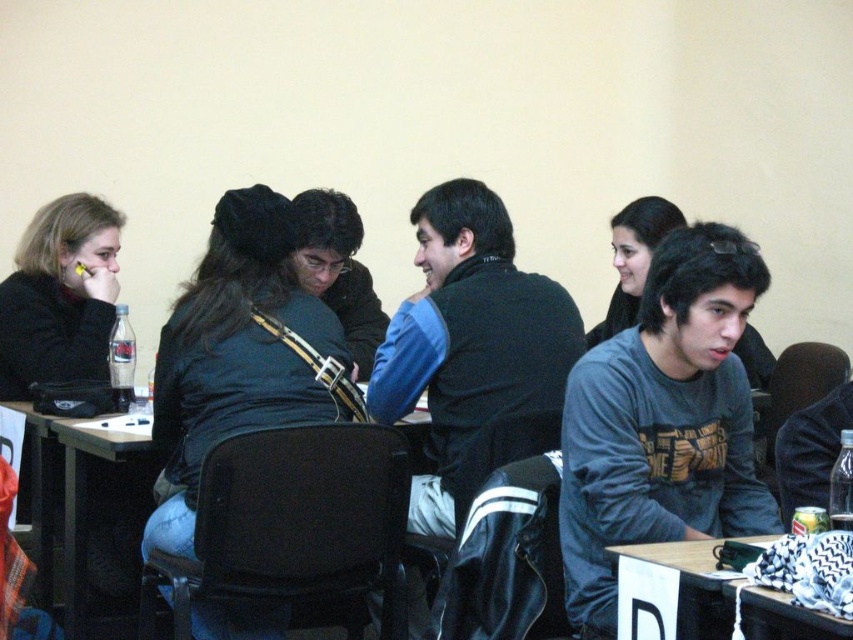
Who is lower down, dark green sweater at center or black plastic table at center?

black plastic table at center is lower down.

Is dark green sweater at center below black plastic table at center?

No, dark green sweater at center is not below black plastic table at center.

The image size is (853, 640). In order to click on dark green sweater at center in this screenshot , I will do `click(242, 342)`.

Where is `dark green sweater at center`? dark green sweater at center is located at coordinates (242, 342).

How far apart are gray cotton shirt at center and dark green sweater at center?

gray cotton shirt at center and dark green sweater at center are 31.90 inches apart from each other.

Which is in front, point (640, 502) or point (190, 416)?

Positioned in front is point (640, 502).

Is point (724, 252) closer to camera compared to point (310, 316)?

Yes, it is in front of point (310, 316).

At what (x,y) coordinates should I click in order to perform the action: click on gray cotton shirt at center. Please return your answer as a coordinate pair (x, y). The height and width of the screenshot is (640, 853). Looking at the image, I should click on (663, 420).

You are a GUI agent. You are given a task and a screenshot of the screen. Output one action in this format:
    pyautogui.click(x=<x>, y=<y>)
    Task: Click on the dark green sweater at center
    The width and height of the screenshot is (853, 640).
    Given the screenshot: What is the action you would take?
    pyautogui.click(x=242, y=342)

You are a GUI agent. You are given a task and a screenshot of the screen. Output one action in this format:
    pyautogui.click(x=<x>, y=<y>)
    Task: Click on the dark green sweater at center
    This screenshot has width=853, height=640.
    Given the screenshot: What is the action you would take?
    pyautogui.click(x=242, y=342)